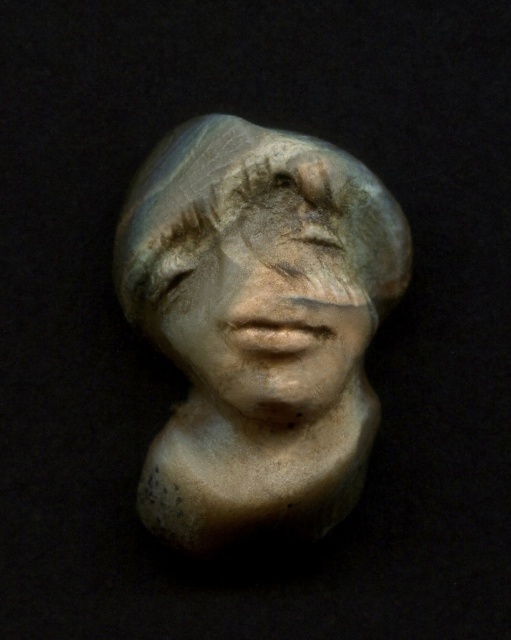
Question: Can you confirm if matte stone bust at center is bigger than matte stone face at center?

Choices:
 (A) no
 (B) yes

Answer: (B)

Question: Observing the image, what is the correct spatial positioning of matte stone bust at center in reference to matte stone face at center?

Choices:
 (A) left
 (B) right

Answer: (A)

Question: Does matte stone bust at center have a lesser width compared to matte stone face at center?

Choices:
 (A) yes
 (B) no

Answer: (B)

Question: Which of the following is the farthest from the observer?

Choices:
 (A) (181, 138)
 (B) (328, 266)

Answer: (A)

Question: Among these points, which one is farthest from the camera?

Choices:
 (A) (220, 352)
 (B) (323, 147)

Answer: (B)